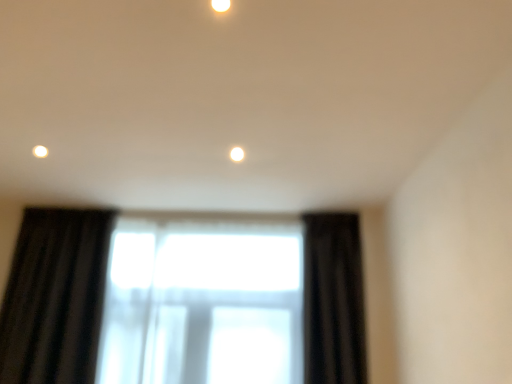
Question: From a real-world perspective, is matte white light fixture at upper center physically located above or below black velvet curtain at right?

Choices:
 (A) below
 (B) above

Answer: (B)

Question: Is matte white light fixture at upper center inside the boundaries of black velvet curtain at right, or outside?

Choices:
 (A) outside
 (B) inside

Answer: (A)

Question: Estimate the real-world distances between objects in this image. Which object is closer to the matte white light fixture at upper center?

Choices:
 (A) black velvet curtain at right
 (B) transparent fabric at center

Answer: (A)

Question: Which of these objects is positioned closest to the transparent fabric at center?

Choices:
 (A) black velvet curtain at right
 (B) matte white light fixture at upper center

Answer: (A)